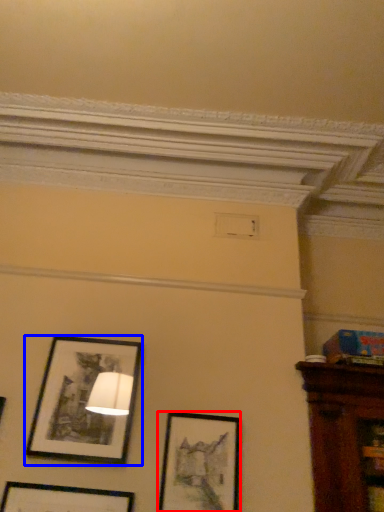
Question: Which object appears farthest to the camera in this image, picture frame (highlighted by a red box) or picture frame (highlighted by a blue box)?

Choices:
 (A) picture frame
 (B) picture frame

Answer: (B)